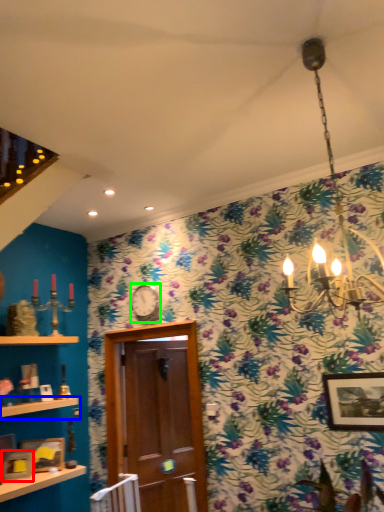
Question: Which object is the closest to the picture frame (highlighted by a red box)? Choose among these: shelf (highlighted by a blue box) or clock (highlighted by a green box).

Choices:
 (A) shelf
 (B) clock

Answer: (A)